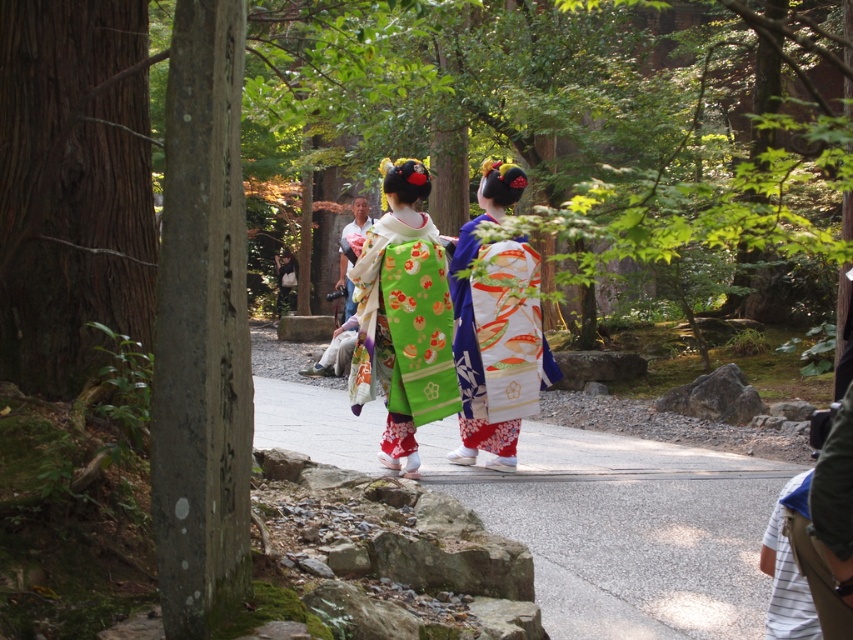
Is smooth asphalt path at center positioned at the back of green silk kimono at center?

No, it is not.

Between point (523, 470) and point (392, 244), which one is positioned in front?

Point (392, 244) is in front.

Identify the location of smooth asphalt path at center. The width and height of the screenshot is (853, 640). (625, 529).

Who is more forward, (436, 397) or (508, 381)?

Point (436, 397)

Does green silk kimono at center have a smaller size compared to white silk kimono at center?

Indeed, green silk kimono at center has a smaller size compared to white silk kimono at center.

Which is behind, point (436, 276) or point (462, 292)?

The point (462, 292) is more distant.

Where is `green silk kimono at center`? The image size is (853, 640). green silk kimono at center is located at coordinates click(403, 317).

Does smooth asphalt path at center lie in front of white silk kimono at center?

Yes, it is in front of white silk kimono at center.

Which is more to the right, smooth asphalt path at center or white silk kimono at center?

smooth asphalt path at center is more to the right.

The image size is (853, 640). What do you see at coordinates (625, 529) in the screenshot?
I see `smooth asphalt path at center` at bounding box center [625, 529].

I want to click on smooth asphalt path at center, so click(x=625, y=529).